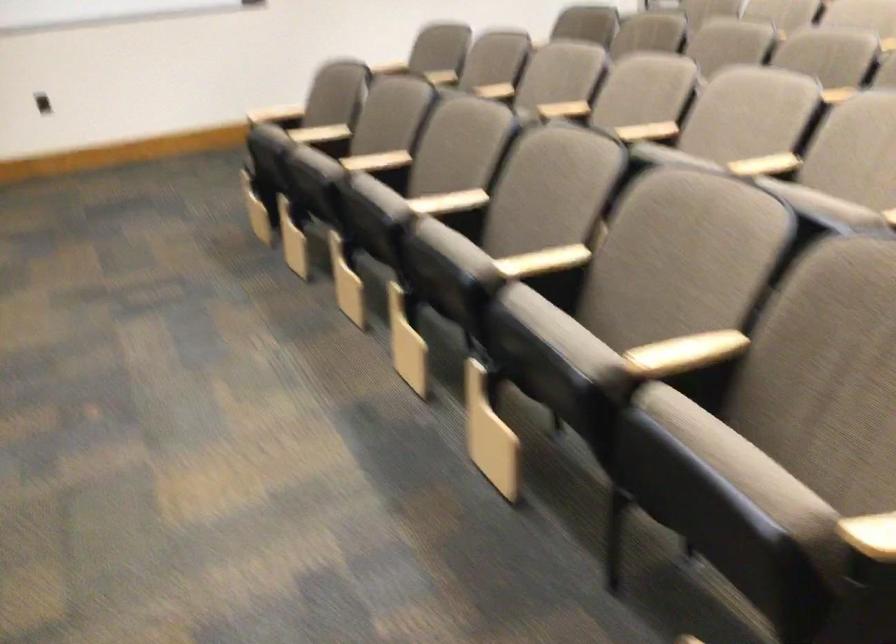
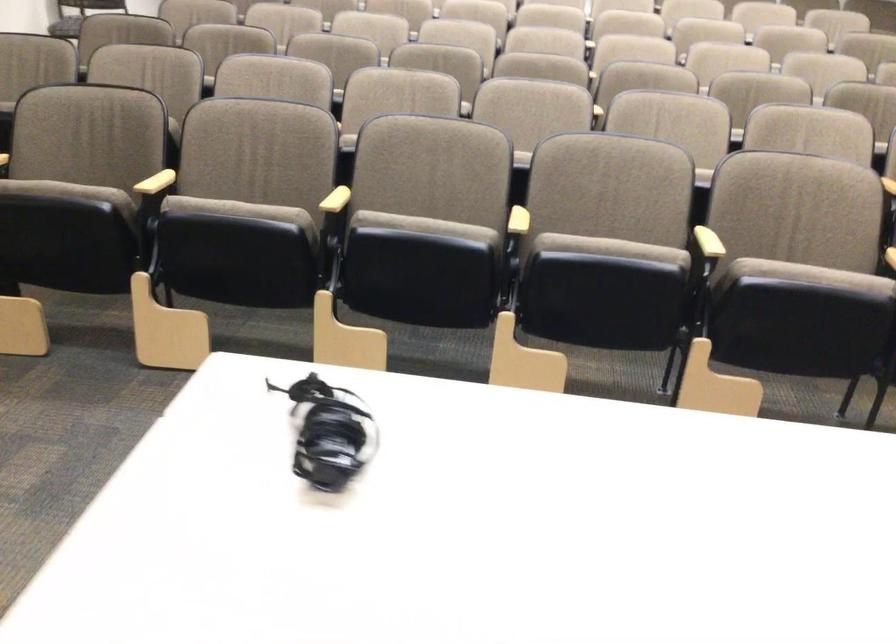
The point at (x=529, y=258) is marked in the first image. Where is the corresponding point in the second image?

(709, 242)